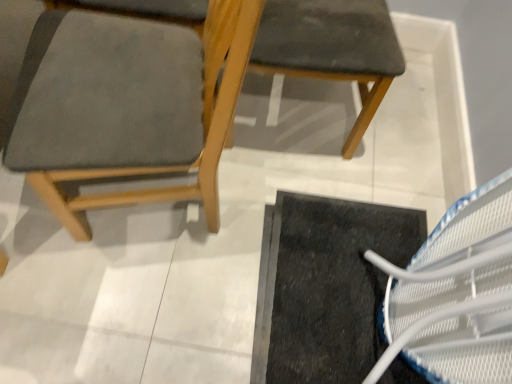
Question: Could you tell me if matte gray cushion at upper right, the 2th chair from the left, is turned towards matte gray fabric chair at left, which is the 2th chair from right to left?

Choices:
 (A) no
 (B) yes

Answer: (A)

Question: Considering the relative positions of matte gray cushion at upper right, the 2th chair from the left, and matte gray fabric chair at left, which is the 2th chair from right to left, in the image provided, is matte gray cushion at upper right, the 2th chair from the left, to the right of matte gray fabric chair at left, which is the 2th chair from right to left, from the viewer's perspective?

Choices:
 (A) yes
 (B) no

Answer: (A)

Question: From a real-world perspective, is matte gray cushion at upper right, the 2th chair from the left, on matte gray fabric chair at left, which is the 2th chair from right to left?

Choices:
 (A) yes
 (B) no

Answer: (B)

Question: Can you confirm if matte gray cushion at upper right, marked as the first chair in a right-to-left arrangement, is shorter than matte gray fabric chair at left, acting as the 1th chair starting from the left?

Choices:
 (A) no
 (B) yes

Answer: (B)

Question: Does matte gray cushion at upper right, the 2th chair from the left, have a smaller size compared to matte gray fabric chair at left, acting as the 1th chair starting from the left?

Choices:
 (A) no
 (B) yes

Answer: (B)

Question: Can you confirm if matte gray cushion at upper right, the 2th chair from the left, is thinner than matte gray fabric chair at left, acting as the 1th chair starting from the left?

Choices:
 (A) yes
 (B) no

Answer: (A)

Question: Is black rubber doormat at lower right far from matte gray fabric chair at left, acting as the 1th chair starting from the left?

Choices:
 (A) yes
 (B) no

Answer: (B)

Question: From the image's perspective, is black rubber doormat at lower right beneath matte gray fabric chair at left, acting as the 1th chair starting from the left?

Choices:
 (A) yes
 (B) no

Answer: (A)

Question: From a real-world perspective, is black rubber doormat at lower right physically above matte gray fabric chair at left, acting as the 1th chair starting from the left?

Choices:
 (A) yes
 (B) no

Answer: (B)

Question: Are black rubber doormat at lower right and matte gray fabric chair at left, which is the 2th chair from right to left, beside each other?

Choices:
 (A) yes
 (B) no

Answer: (B)

Question: Is black rubber doormat at lower right further to the viewer compared to matte gray fabric chair at left, acting as the 1th chair starting from the left?

Choices:
 (A) no
 (B) yes

Answer: (B)

Question: Does black rubber doormat at lower right have a greater width compared to matte gray fabric chair at left, which is the 2th chair from right to left?

Choices:
 (A) yes
 (B) no

Answer: (A)

Question: Is matte gray fabric chair at left, which is the 2th chair from right to left, shorter than black rubber doormat at lower right?

Choices:
 (A) yes
 (B) no

Answer: (B)